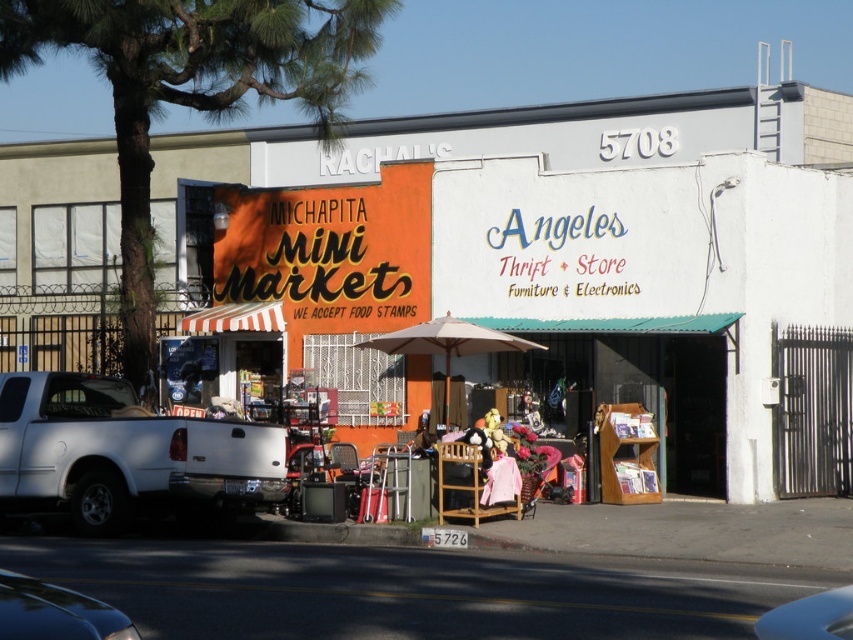
In the scene shown: You are a pedestrian standing at the crosswalk in front of the two stores. You need to cross the street to reach the Mini Market. Which vehicle, the white matte pickup truck at left or the shiny black car at lower left, is closer to you as you stand at the crosswalk?

The white matte pickup truck at left is closer to you because it is further to the viewer than the shiny black car at lower left, meaning it is positioned nearer in the scene.

You are a delivery driver needing to park your vehicle in this street scene. You have a white matte pickup truck at left and a blue glossy car at lower right. Which vehicle is positioned closer to the curb on the left side of the street?

The white matte pickup truck at left is positioned closer to the curb on the left side of the street since it is to the left of the blue glossy car at lower right.

You are driving a delivery van that is 3.8 meters long and need to park between the shiny black car at lower left and the blue glossy car at lower right. Is there enough space for your van to fit between them?

The shiny black car at lower left and blue glossy car at lower right are 3.44 meters apart. Since your van is 3.8 meters long, which is longer than the available space, you cannot park your van between them.